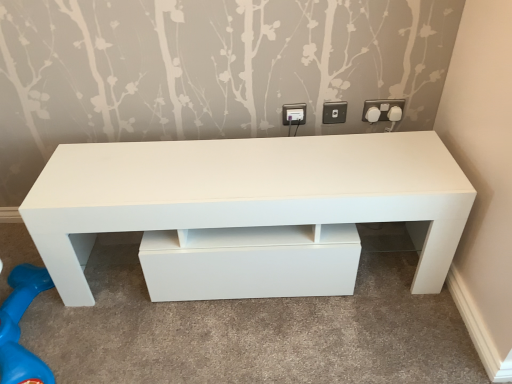
Question: Is white plastic knob at upper right, the second knob when ordered from left to right, bigger than white plastic knob at upper right, which appears as the first knob when viewed from the left?

Choices:
 (A) yes
 (B) no

Answer: (A)

Question: Considering the relative sizes of white plastic knob at upper right, the first knob from the right, and white plastic knob at upper right, the 2th knob when ordered from right to left, in the image provided, is white plastic knob at upper right, the first knob from the right, taller than white plastic knob at upper right, the 2th knob when ordered from right to left,?

Choices:
 (A) yes
 (B) no

Answer: (B)

Question: Is white plastic knob at upper right, the first knob from the right, next to white plastic knob at upper right, which appears as the first knob when viewed from the left?

Choices:
 (A) yes
 (B) no

Answer: (A)

Question: Considering the relative positions of white plastic knob at upper right, the second knob when ordered from left to right, and white plastic knob at upper right, which appears as the first knob when viewed from the left, in the image provided, is white plastic knob at upper right, the second knob when ordered from left to right, to the left of white plastic knob at upper right, which appears as the first knob when viewed from the left, from the viewer's perspective?

Choices:
 (A) yes
 (B) no

Answer: (B)

Question: Would you consider white plastic knob at upper right, the second knob when ordered from left to right, to be distant from white plastic knob at upper right, which appears as the first knob when viewed from the left?

Choices:
 (A) no
 (B) yes

Answer: (A)

Question: From their relative heights in the image, would you say white plastic socket at upper right, which is the 3th electric outlet in left-to-right order, is taller or shorter than white plastic socket at upper right, placed as the 2th electric outlet when sorted from right to left?

Choices:
 (A) short
 (B) tall

Answer: (B)

Question: From the image's perspective, relative to white plastic socket at upper right, the second electric outlet viewed from the left, is white plastic socket at upper right, which is the 3th electric outlet in left-to-right order, above or below?

Choices:
 (A) above
 (B) below

Answer: (A)

Question: Choose the correct answer: Is white plastic socket at upper right, acting as the first electric outlet starting from the right, inside white plastic socket at upper right, the second electric outlet viewed from the left, or outside it?

Choices:
 (A) inside
 (B) outside

Answer: (B)

Question: Based on their sizes in the image, would you say white plastic socket at upper right, acting as the first electric outlet starting from the right, is bigger or smaller than white plastic socket at upper right, placed as the 2th electric outlet when sorted from right to left?

Choices:
 (A) small
 (B) big

Answer: (B)

Question: Based on their sizes in the image, would you say white plastic knob at upper right, which appears as the first knob when viewed from the left, is bigger or smaller than white plastic electric outlet at upper center, the 1th electric outlet viewed from the left?

Choices:
 (A) small
 (B) big

Answer: (B)

Question: Would you say white plastic knob at upper right, which appears as the first knob when viewed from the left, is to the left or to the right of white plastic electric outlet at upper center, the 3th electric outlet viewed from the right, in the picture?

Choices:
 (A) left
 (B) right

Answer: (B)

Question: Is white plastic knob at upper right, the 2th knob when ordered from right to left, in front of or behind white plastic electric outlet at upper center, the 3th electric outlet viewed from the right, in the image?

Choices:
 (A) behind
 (B) front

Answer: (B)

Question: Is white plastic knob at upper right, the 2th knob when ordered from right to left, inside or outside of white plastic electric outlet at upper center, the 3th electric outlet viewed from the right?

Choices:
 (A) inside
 (B) outside

Answer: (B)

Question: From a real-world perspective, is white plastic socket at upper right, the second electric outlet viewed from the left, positioned above or below white plastic knob at upper right, the second knob when ordered from left to right?

Choices:
 (A) above
 (B) below

Answer: (A)

Question: Looking at the image, does white plastic socket at upper right, placed as the 2th electric outlet when sorted from right to left, seem bigger or smaller compared to white plastic knob at upper right, the second knob when ordered from left to right?

Choices:
 (A) small
 (B) big

Answer: (A)